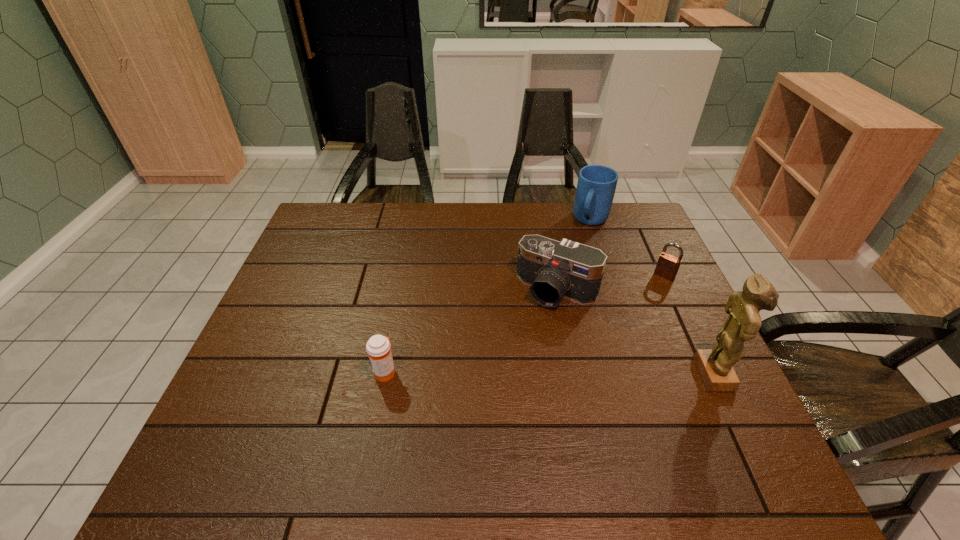
The height and width of the screenshot is (540, 960). Identify the location of free space between the leftmost object and the tallest object. (550, 373).

Where is `vacant area between the padlock and the medicine`? Image resolution: width=960 pixels, height=540 pixels. vacant area between the padlock and the medicine is located at coordinates (524, 323).

Locate an element on the screen. This screenshot has height=540, width=960. vacant area that lies between the mug and the padlock is located at coordinates (628, 248).

Locate an element on the screen. Image resolution: width=960 pixels, height=540 pixels. free space between the figurine and the padlock is located at coordinates (690, 325).

I want to click on free space between the leftmost object and the second tallest object, so click(488, 296).

Image resolution: width=960 pixels, height=540 pixels. Identify the location of free space between the tallest object and the padlock. (690, 325).

Select which object is the third closest to the camera. Please provide its 2D coordinates. Your answer should be formatted as a tuple, i.e. [(x, y)], where the tuple contains the x and y coordinates of a point satisfying the conditions above.

[(715, 366)]

Choose which object is the third nearest neighbor to the third tallest object. Please provide its 2D coordinates. Your answer should be formatted as a tuple, i.e. [(x, y)], where the tuple contains the x and y coordinates of a point satisfying the conditions above.

[(715, 366)]